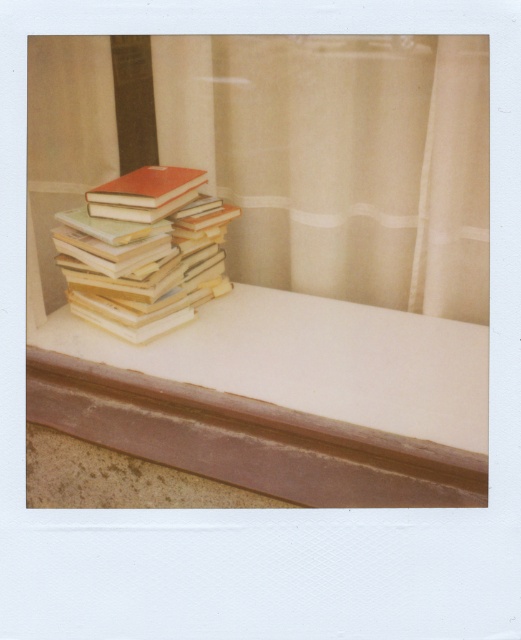
You are a book collector who wants to place a new book on the white smooth window sill at center. To ensure proper placement, what coordinates should you aim for?

The white smooth window sill at center is located at coordinates point [282,397], so you should aim for that point.

You are organizing a bookshelf and need to know the relative sizes of the items. Given that you have a sheer beige curtain at upper center and a matte orange book at center, which one is bigger?

The sheer beige curtain at upper center is larger than the matte orange book at center.

Consider the image. You are organizing books on the white smooth window sill at center and the matte orange book at center. Which object is located to the right of the other?

The white smooth window sill at center is positioned on the right side of matte orange book at center, so it is to the right of the matte orange book at center.